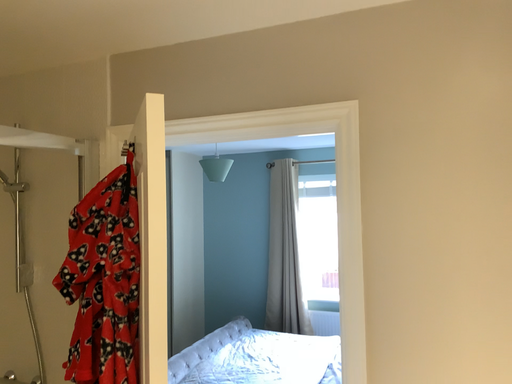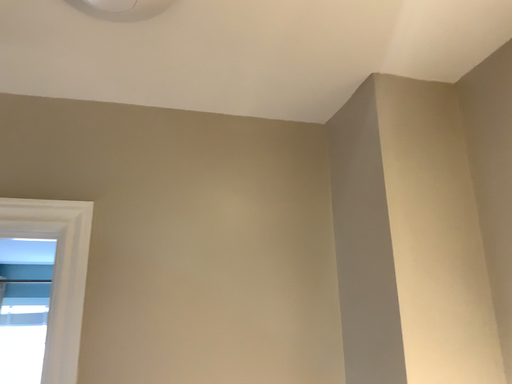
Question: How did the camera likely rotate when shooting the video?

Choices:
 (A) rotated right
 (B) rotated left

Answer: (A)